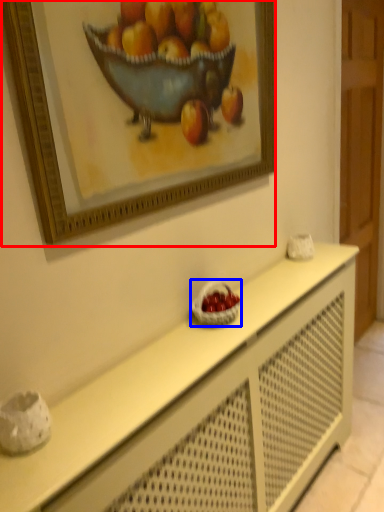
Question: Which object appears closest to the camera in this image, picture frame (highlighted by a red box) or basket (highlighted by a blue box)?

Choices:
 (A) picture frame
 (B) basket

Answer: (A)